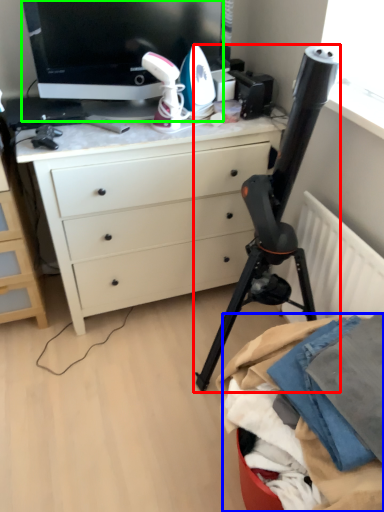
Question: Estimate the real-world distances between objects in this image. Which object is farther from tripod (highlighted by a red box), clothing (highlighted by a blue box) or television (highlighted by a green box)?

Choices:
 (A) clothing
 (B) television

Answer: (B)